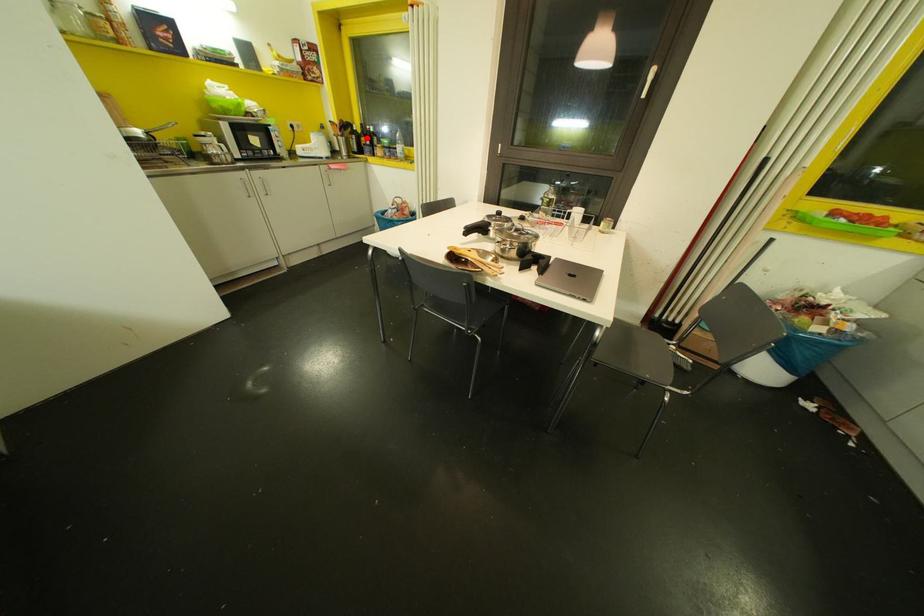
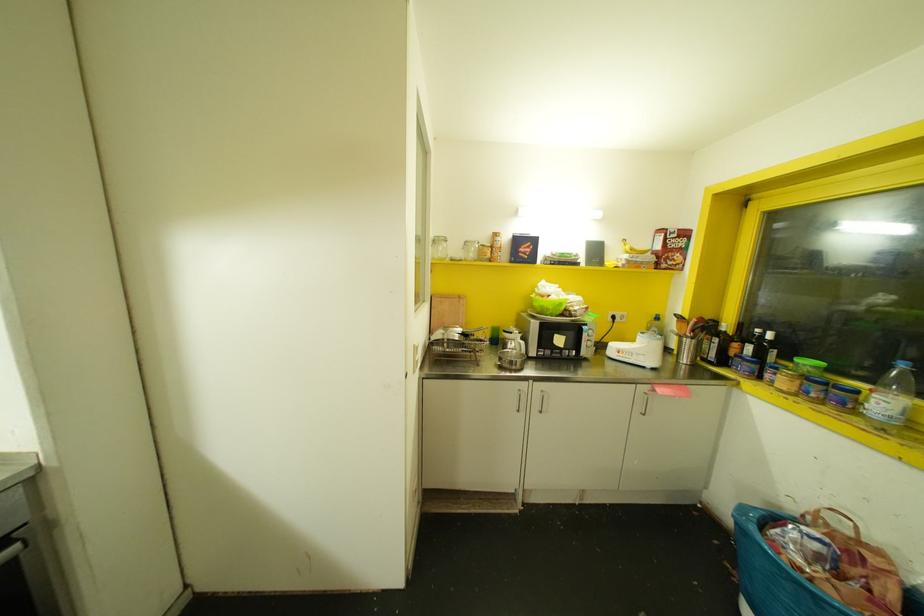
Question: I am providing you with two images of the same scene from different viewpoints. Given a red point in image1, look at the same physical point in image2. Is it:

Choices:
 (A) Closer to the viewpoint
 (B) Farther from the viewpoint

Answer: (B)